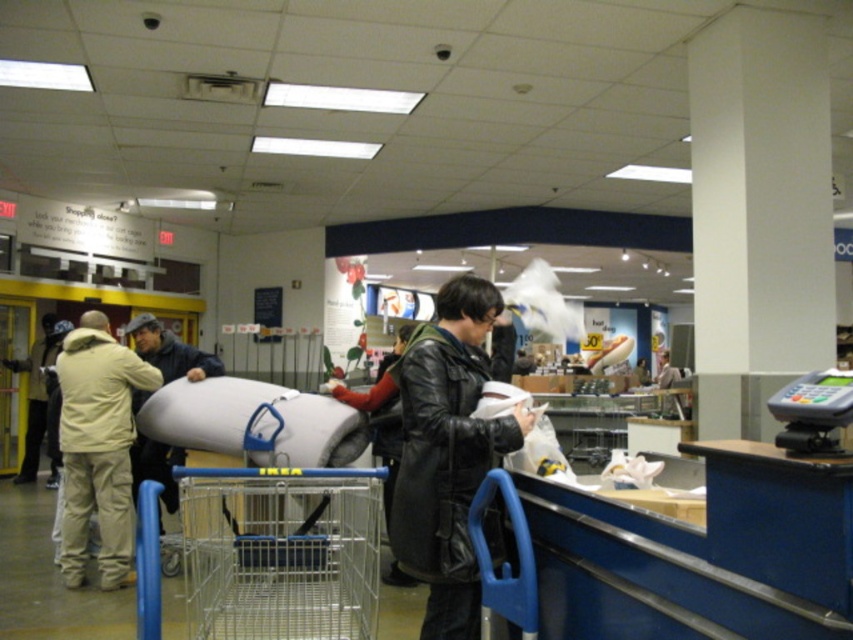
Does black leather jacket at center have a lesser width compared to beige wool jacket at left?

Indeed, black leather jacket at center has a lesser width compared to beige wool jacket at left.

Between black leather jacket at center and beige wool jacket at left, which one has less height?

black leather jacket at center

Find the location of a particular element. Image resolution: width=853 pixels, height=640 pixels. black leather jacket at center is located at coordinates click(450, 449).

Does beige fabric jacket at left have a greater height compared to dark blue jacket at center?

Indeed, beige fabric jacket at left has a greater height compared to dark blue jacket at center.

Is beige fabric jacket at left further to camera compared to dark blue jacket at center?

No, beige fabric jacket at left is closer to the viewer.

Find the location of `beige fabric jacket at left`. beige fabric jacket at left is located at coordinates (97, 449).

Image resolution: width=853 pixels, height=640 pixels. In order to click on beige fabric jacket at left in this screenshot , I will do `click(97, 449)`.

Can you confirm if beige fabric jacket at left is smaller than beige wool jacket at left?

Yes, beige fabric jacket at left is smaller than beige wool jacket at left.

From the picture: Who is more forward, (x=82, y=481) or (x=57, y=340)?

Positioned in front is point (x=82, y=481).

Find the location of `beige fabric jacket at left`. beige fabric jacket at left is located at coordinates (97, 449).